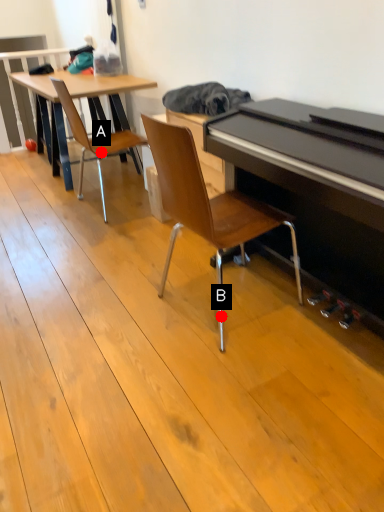
Question: Two points are circled on the image, labeled by A and B beside each circle. Which point appears closest to the camera in this image?

Choices:
 (A) A is closer
 (B) B is closer

Answer: (B)